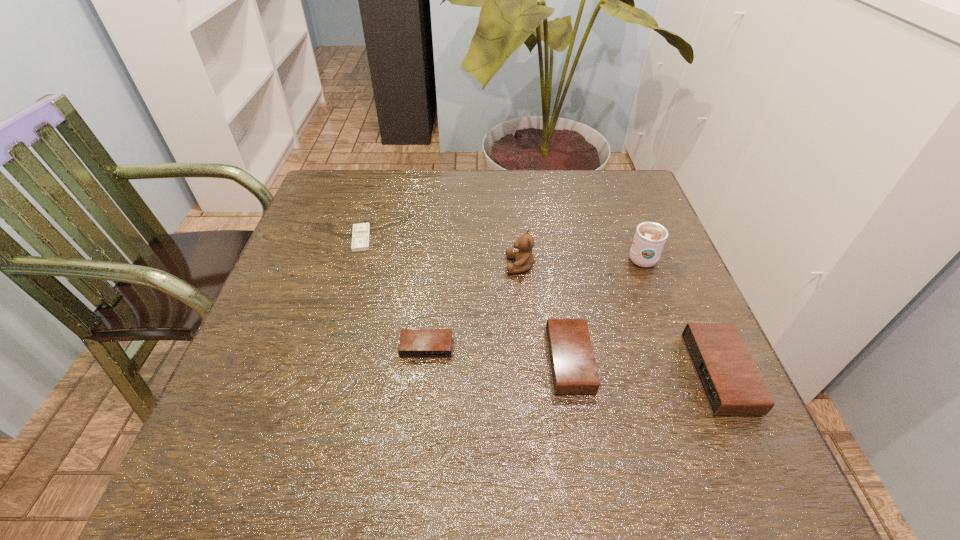
This screenshot has width=960, height=540. In order to click on the shortest alarm clock in this screenshot , I will do `click(414, 343)`.

Where is `the leftmost alarm clock`? The height and width of the screenshot is (540, 960). the leftmost alarm clock is located at coordinates [x=414, y=343].

Locate an element on the screen. the third object from right to left is located at coordinates (573, 367).

Find the location of a particular element. Image resolution: width=960 pixels, height=540 pixels. the second shortest alarm clock is located at coordinates (573, 367).

Locate an element on the screen. This screenshot has width=960, height=540. the rightmost alarm clock is located at coordinates (732, 385).

Image resolution: width=960 pixels, height=540 pixels. I want to click on the third object from left to right, so click(524, 258).

I want to click on teddy bear, so click(524, 258).

At what (x,y) coordinates should I click in order to perform the action: click on the shortest object. Please return your answer as a coordinate pair (x, y). This screenshot has height=540, width=960. Looking at the image, I should click on (361, 232).

I want to click on money, so click(x=361, y=232).

Locate an element on the screen. The image size is (960, 540). cup is located at coordinates (650, 237).